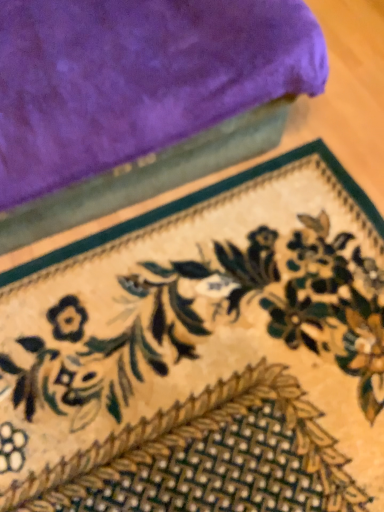
Locate an element on the screen. The height and width of the screenshot is (512, 384). free space in front of velvet purple towel at upper left is located at coordinates pos(191,339).